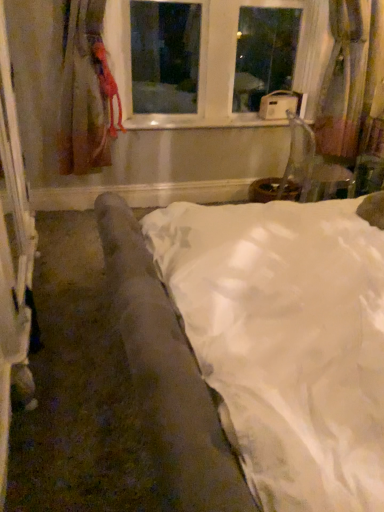
Describe the element at coordinates (199, 121) in the screenshot. This screenshot has width=384, height=512. I see `white glossy window sill at center` at that location.

In order to face matte red curtain at left, the 2th curtain from the right, should I rotate leftwards or rightwards?

A 12.004 degree turn to the left will do.

This screenshot has height=512, width=384. What are the coordinates of `velvet-like pink curtain at right, which ranks as the second curtain in left-to-right order` in the screenshot? It's located at (350, 76).

Locate an element on the screen. Image resolution: width=384 pixels, height=512 pixels. velvet brown armchair at lower right is located at coordinates (313, 167).

Where is `white glossy window sill at center`? white glossy window sill at center is located at coordinates (199, 121).

Which is closer to the camera, (x=179, y=125) or (x=322, y=42)?

Point (x=179, y=125) appears to be farther away from the viewer than point (x=322, y=42).

Considering the sizes of objects white glossy window sill at center and white plastic window at upper center in the image provided, who is smaller, white glossy window sill at center or white plastic window at upper center?

Smaller between the two is white glossy window sill at center.

From the image's perspective, is white glossy window sill at center below white plastic window at upper center?

Yes, from the image's perspective, white glossy window sill at center is beneath white plastic window at upper center.

Considering the relative sizes of white glossy window sill at center and white plastic window at upper center in the image provided, is white glossy window sill at center thinner than white plastic window at upper center?

Correct, the width of white glossy window sill at center is less than that of white plastic window at upper center.

Considering the sizes of objects white plastic window at upper center and velvet-like pink curtain at right, which ranks as the second curtain in left-to-right order, in the image provided, who is smaller, white plastic window at upper center or velvet-like pink curtain at right, which ranks as the second curtain in left-to-right order,?

velvet-like pink curtain at right, which ranks as the second curtain in left-to-right order, is smaller.

Consider the image. How many degrees apart are the facing directions of white plastic window at upper center and velvet-like pink curtain at right, positioned as the 1th curtain in right-to-left order?

white plastic window at upper center and velvet-like pink curtain at right, positioned as the 1th curtain in right-to-left order, are facing 3.02 degrees away from each other.

Is point (124, 54) less distant than point (335, 128)?

Yes, point (124, 54) is closer to viewer.

Is white glossy window sill at center thinner than velvet-like pink curtain at right, which ranks as the second curtain in left-to-right order?

Indeed, white glossy window sill at center has a lesser width compared to velvet-like pink curtain at right, which ranks as the second curtain in left-to-right order.

Does white glossy window sill at center have a greater height compared to velvet-like pink curtain at right, positioned as the 1th curtain in right-to-left order?

No, white glossy window sill at center is not taller than velvet-like pink curtain at right, positioned as the 1th curtain in right-to-left order.

From a real-world perspective, which object rests below the other?

white glossy window sill at center is physically lower.

Can we say white glossy window sill at center lies outside velvet-like pink curtain at right, positioned as the 1th curtain in right-to-left order?

Yes, white glossy window sill at center is not within velvet-like pink curtain at right, positioned as the 1th curtain in right-to-left order.

From the image's perspective, is white plastic window at upper center above white satin bed at center?

Yes.

Find the location of a particular element. bed on the right of the white plastic window at upper center is located at coordinates (167, 373).

Considering the sizes of white plastic window at upper center and white satin bed at center in the image, is white plastic window at upper center wider or thinner than white satin bed at center?

Considering their sizes, white plastic window at upper center looks slimmer than white satin bed at center.

Based on the photo, considering the positions of objects white plastic window at upper center and white satin bed at center in the image provided, who is more to the right, white plastic window at upper center or white satin bed at center?

white satin bed at center.

Considering the sizes of objects white satin bed at center and velvet brown armchair at lower right in the image provided, who is wider, white satin bed at center or velvet brown armchair at lower right?

With larger width is white satin bed at center.

Is white satin bed at center next to velvet brown armchair at lower right and touching it?

No, white satin bed at center is not making contact with velvet brown armchair at lower right.

From the image's perspective, is white satin bed at center located beneath velvet brown armchair at lower right?

Yes, from the image's perspective, white satin bed at center is below velvet brown armchair at lower right.

Between white satin bed at center and velvet brown armchair at lower right, which one has more height?

velvet brown armchair at lower right is taller.

Is matte red curtain at left, acting as the 1th curtain starting from the left, bigger than white glossy window sill at center?

Yes.

Is matte red curtain at left, the 2th curtain from the right, oriented towards white glossy window sill at center?

No, matte red curtain at left, the 2th curtain from the right, is not oriented towards white glossy window sill at center.

Which is behind, point (65, 117) or point (247, 125)?

Positioned behind is point (247, 125).

At what (x,y) coordinates should I click in order to perform the action: click on window sill lying on the right of matte red curtain at left, acting as the 1th curtain starting from the left. Please return your answer as a coordinate pair (x, y). Looking at the image, I should click on (199, 121).

Are white satin bed at center and matte red curtain at left, the 2th curtain from the right, far apart?

Yes, white satin bed at center and matte red curtain at left, the 2th curtain from the right, are quite far apart.

Who is shorter, white satin bed at center or matte red curtain at left, acting as the 1th curtain starting from the left?

white satin bed at center.

Which is behind, white satin bed at center or matte red curtain at left, the 2th curtain from the right?

matte red curtain at left, the 2th curtain from the right, is further from the camera.

Is white satin bed at center aimed at matte red curtain at left, the 2th curtain from the right?

No, white satin bed at center is not facing towards matte red curtain at left, the 2th curtain from the right.

Find the location of `window sill that is below the white plastic window at upper center (from the image's perspective)`. window sill that is below the white plastic window at upper center (from the image's perspective) is located at coordinates (199, 121).

The height and width of the screenshot is (512, 384). What are the coordinates of `window that is in front of the velvet-like pink curtain at right, positioned as the 1th curtain in right-to-left order` in the screenshot? It's located at (217, 60).

From the image, which object appears to be farther from white plastic window at upper center, velvet brown armchair at lower right or white satin bed at center?

white satin bed at center is further to white plastic window at upper center.

Looking at the image, which one is located closer to velvet-like pink curtain at right, which ranks as the second curtain in left-to-right order, matte red curtain at left, the 2th curtain from the right, or velvet brown armchair at lower right?

velvet brown armchair at lower right.

Considering their positions, is velvet-like pink curtain at right, which ranks as the second curtain in left-to-right order, positioned closer to white plastic window at upper center than white satin bed at center?

velvet-like pink curtain at right, which ranks as the second curtain in left-to-right order, lies closer to white plastic window at upper center than the other object.

Considering their positions, is white plastic window at upper center positioned closer to velvet brown armchair at lower right than white glossy window sill at center?

white glossy window sill at center.

From the image, which object appears to be farther from white plastic window at upper center, velvet brown armchair at lower right or matte red curtain at left, the 2th curtain from the right?

Among the two, velvet brown armchair at lower right is located further to white plastic window at upper center.

From the picture: Looking at the image, which one is located closer to white satin bed at center, white glossy window sill at center or matte red curtain at left, acting as the 1th curtain starting from the left?

matte red curtain at left, acting as the 1th curtain starting from the left, is positioned closer to the anchor white satin bed at center.

From the image, which object appears to be nearer to velvet-like pink curtain at right, which ranks as the second curtain in left-to-right order, white plastic window at upper center or white glossy window sill at center?

Among the two, white plastic window at upper center is located nearer to velvet-like pink curtain at right, which ranks as the second curtain in left-to-right order.

Looking at the image, which one is located closer to white glossy window sill at center, white plastic window at upper center or velvet-like pink curtain at right, positioned as the 1th curtain in right-to-left order?

white plastic window at upper center is closer to white glossy window sill at center.

This screenshot has width=384, height=512. Identify the location of armchair situated between matte red curtain at left, acting as the 1th curtain starting from the left, and velvet-like pink curtain at right, which ranks as the second curtain in left-to-right order, from left to right. (313, 167).

This screenshot has width=384, height=512. Identify the location of window sill located between matte red curtain at left, acting as the 1th curtain starting from the left, and white plastic window at upper center in the left-right direction. (199, 121).

Where is `window sill between matte red curtain at left, acting as the 1th curtain starting from the left, and velvet-like pink curtain at right, positioned as the 1th curtain in right-to-left order`? window sill between matte red curtain at left, acting as the 1th curtain starting from the left, and velvet-like pink curtain at right, positioned as the 1th curtain in right-to-left order is located at coordinates (199, 121).

Where is `armchair between white glossy window sill at center and velvet-like pink curtain at right, positioned as the 1th curtain in right-to-left order, from left to right`? Image resolution: width=384 pixels, height=512 pixels. armchair between white glossy window sill at center and velvet-like pink curtain at right, positioned as the 1th curtain in right-to-left order, from left to right is located at coordinates (313, 167).